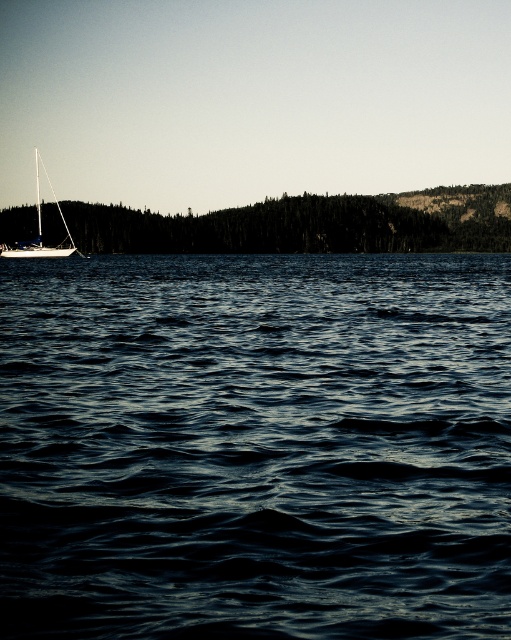
Question: Is dark blue water at center in front of green matte tree at left?

Choices:
 (A) no
 (B) yes

Answer: (B)

Question: Which of the following is the farthest from the observer?

Choices:
 (A) (398, 248)
 (B) (451, 618)

Answer: (A)

Question: Is green matte tree at left above white matte sailboat at left?

Choices:
 (A) no
 (B) yes

Answer: (A)

Question: Can you confirm if dark blue water at center is bigger than white matte sailboat at left?

Choices:
 (A) yes
 (B) no

Answer: (B)

Question: Which of the following is the farthest from the observer?

Choices:
 (A) green matte tree at left
 (B) dark blue water at center
 (C) white matte sailboat at left

Answer: (A)

Question: Which object is positioned closest to the green matte tree at left?

Choices:
 (A) white matte sailboat at left
 (B) dark blue water at center

Answer: (A)